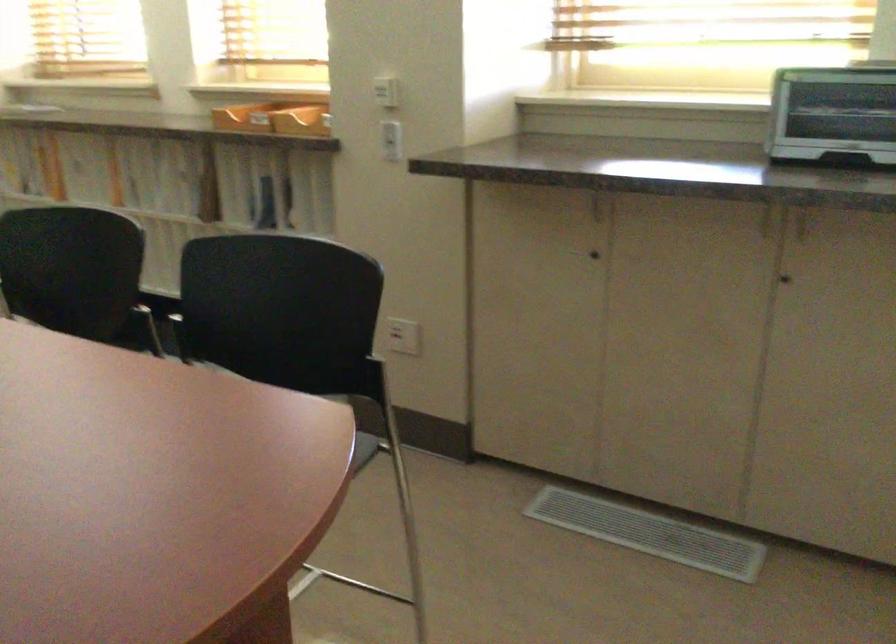
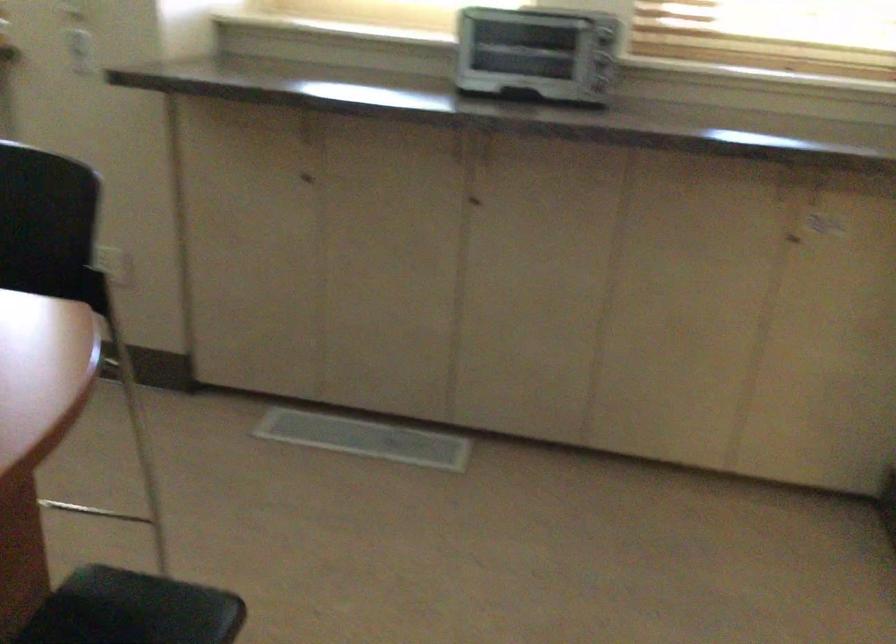
Question: The first image is from the beginning of the video and the second image is from the end. How did the camera likely rotate when shooting the video?

Choices:
 (A) Left
 (B) Right
 (C) Up
 (D) Down

Answer: (B)